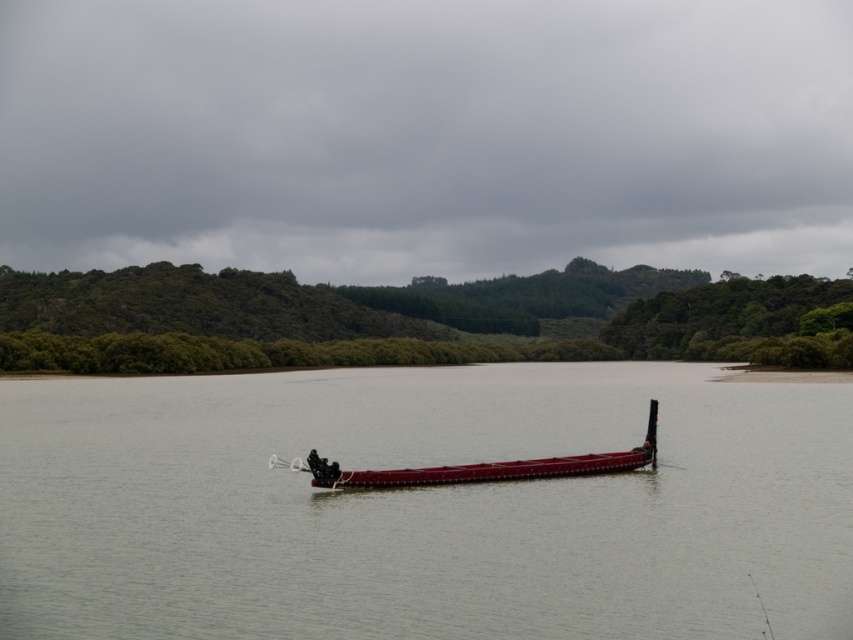
Is smooth water at center smaller than shiny red canoe at center?

Actually, smooth water at center might be larger than shiny red canoe at center.

Is point (808, 385) positioned after point (489, 474)?

Yes, it is behind point (489, 474).

Does point (253, 396) come closer to viewer compared to point (418, 476)?

No, it is behind (418, 476).

Where is `smooth water at center`? The height and width of the screenshot is (640, 853). smooth water at center is located at coordinates pyautogui.click(x=424, y=506).